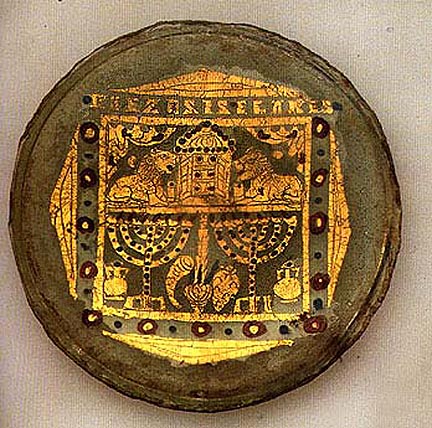
Locate an element on the screen. candle holder is located at coordinates (151, 250), (244, 232).